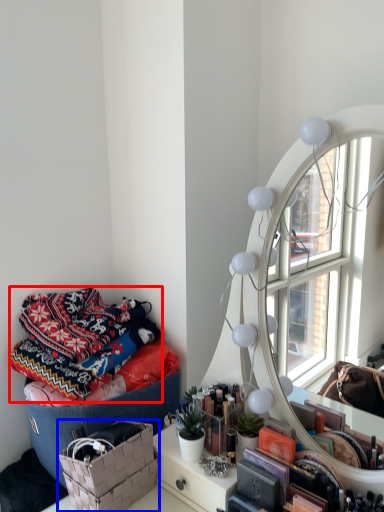
Question: Which point is further to the camera, blanket (highlighted by a red box) or basket (highlighted by a blue box)?

Choices:
 (A) blanket
 (B) basket

Answer: (A)